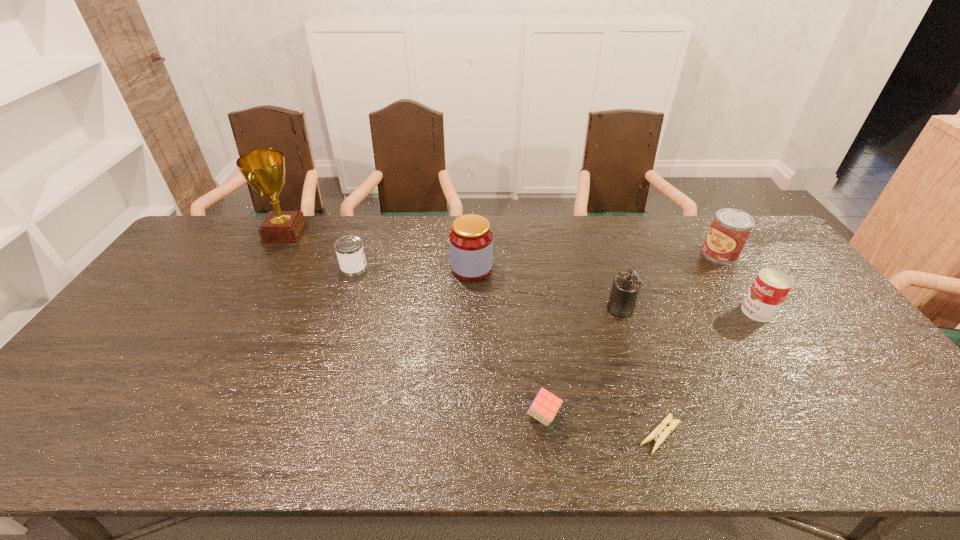
Where is `the tallest object`? This screenshot has height=540, width=960. the tallest object is located at coordinates (264, 170).

At what (x,y) coordinates should I click in order to perform the action: click on the leftmost object. Please return your answer as a coordinate pair (x, y). The height and width of the screenshot is (540, 960). Looking at the image, I should click on (264, 170).

Where is `jar`? jar is located at coordinates (471, 240).

Find the location of `the sixth object from right to left`. the sixth object from right to left is located at coordinates (471, 240).

Image resolution: width=960 pixels, height=540 pixels. Find the location of `the third can from right to left`. the third can from right to left is located at coordinates (627, 284).

You are a GUI agent. You are given a task and a screenshot of the screen. Output one action in this format:
    pyautogui.click(x=<x>, y=<y>)
    Task: Click on the shortest can
    
    Given the screenshot: What is the action you would take?
    pyautogui.click(x=349, y=249)

This screenshot has height=540, width=960. In order to click on the second object from left to right in this screenshot , I will do `click(349, 249)`.

The width and height of the screenshot is (960, 540). In order to click on the fourth object from left to right in this screenshot , I will do `click(545, 406)`.

This screenshot has width=960, height=540. I want to click on cube, so click(x=545, y=406).

Image resolution: width=960 pixels, height=540 pixels. What are the coordinates of `the shortest object` in the screenshot? It's located at (656, 434).